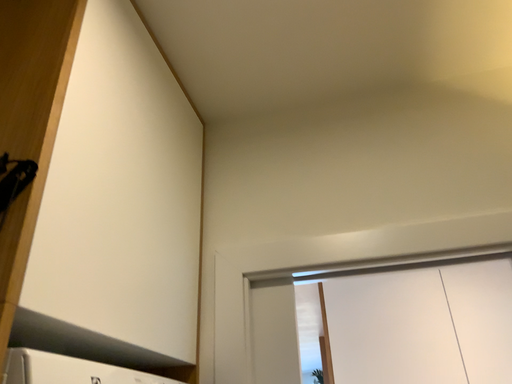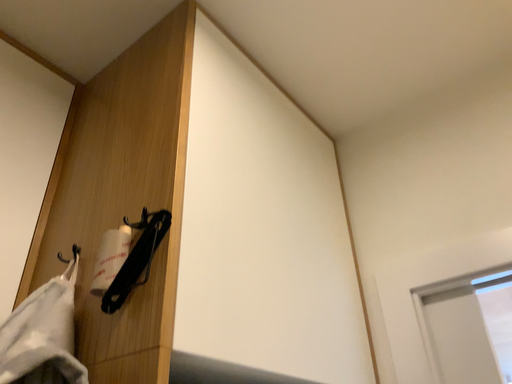
Question: Which way did the camera rotate in the video?

Choices:
 (A) rotated right
 (B) rotated left

Answer: (B)